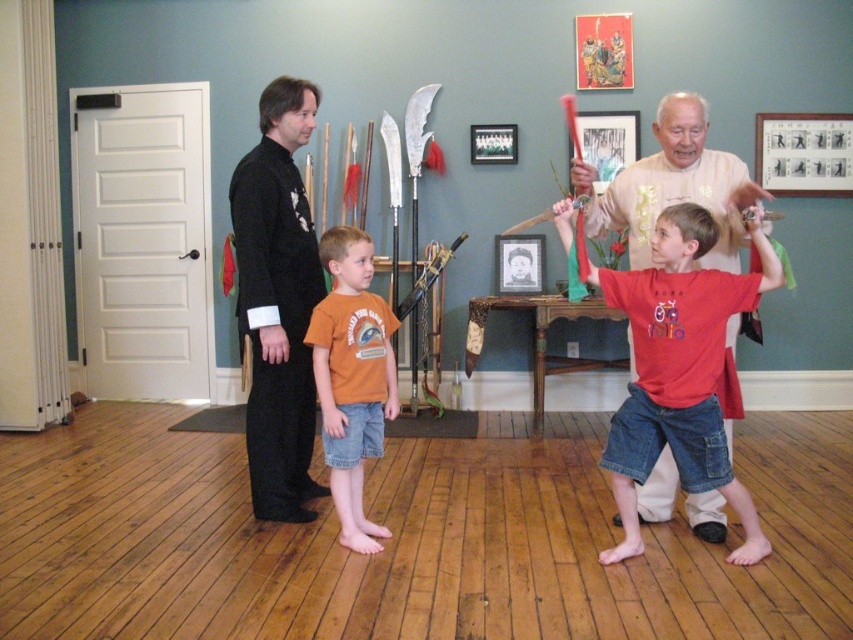
At what (x,y) coordinates should I click in order to perform the action: click on black paper picture frame at center. Please return your answer as a coordinate pair (x, y). Looking at the image, I should click on (519, 262).

Does black paper picture frame at center appear under black matte picture frame at upper center?

Yes.

Is point (495, 276) closer to viewer compared to point (483, 141)?

No, it is not.

Where is `black paper picture frame at center`? This screenshot has height=640, width=853. black paper picture frame at center is located at coordinates (519, 262).

Consider the image. Which of these two, black silk kimono at left or black matte picture frame at upper center, stands shorter?

With less height is black matte picture frame at upper center.

Which is more to the right, black silk kimono at left or black matte picture frame at upper center?

From the viewer's perspective, black matte picture frame at upper center appears more on the right side.

Between point (247, 291) and point (485, 147), which one is positioned behind?

The point (485, 147) is more distant.

Where is `black silk kimono at left`? Image resolution: width=853 pixels, height=640 pixels. black silk kimono at left is located at coordinates (277, 301).

The height and width of the screenshot is (640, 853). Identify the location of orange cotton t-shirt at center. (352, 378).

Image resolution: width=853 pixels, height=640 pixels. What are the coordinates of `orange cotton t-shirt at center` in the screenshot? It's located at (352, 378).

Find the location of `orange cotton t-shirt at center`. orange cotton t-shirt at center is located at coordinates [352, 378].